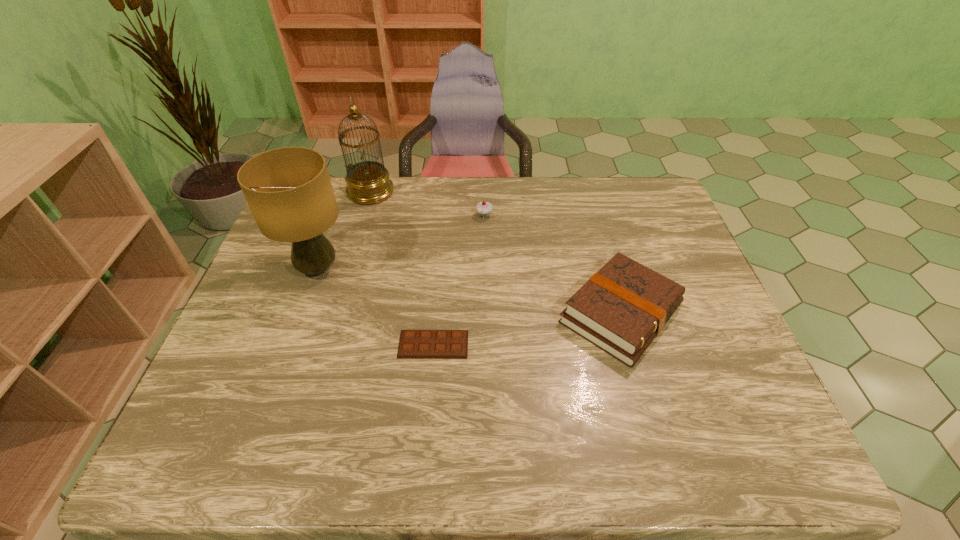
The width and height of the screenshot is (960, 540). I want to click on free space at the near edge of the desktop, so click(x=463, y=442).

Where is `free spot at the left edge of the desktop`? free spot at the left edge of the desktop is located at coordinates (227, 384).

Identify the location of blank space at the right edge of the desktop. Image resolution: width=960 pixels, height=540 pixels. (706, 373).

At what (x,y) coordinates should I click in order to perform the action: click on vacant area at the near left corner of the desktop. Please return your answer as a coordinate pair (x, y). Looking at the image, I should click on (184, 454).

The image size is (960, 540). Find the location of `free space at the far right corner of the desktop`. free space at the far right corner of the desktop is located at coordinates (634, 189).

Locate an element on the screen. free space between the cupcake and the rightmost object is located at coordinates (552, 265).

Where is `free spot between the fourth tallest object and the lampshade`? free spot between the fourth tallest object and the lampshade is located at coordinates (469, 291).

I want to click on vacant space that is in between the birdcage and the rightmost object, so click(x=495, y=252).

This screenshot has width=960, height=540. Find the location of `empty space between the chocolate bar and the birdcage`. empty space between the chocolate bar and the birdcage is located at coordinates (402, 268).

Image resolution: width=960 pixels, height=540 pixels. In order to click on free space between the hardback book and the birdcage in this screenshot , I will do `click(495, 252)`.